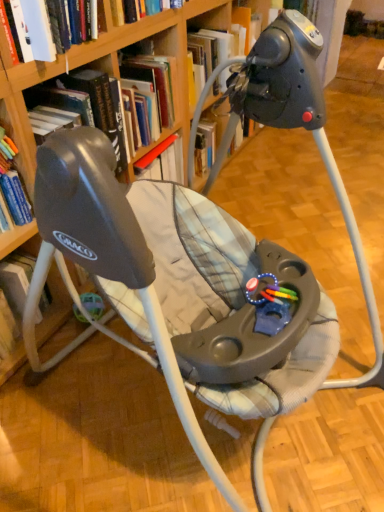
Where is `vacant area situated below wooden bookcase at upper center (from a real-world perspective)`? The height and width of the screenshot is (512, 384). vacant area situated below wooden bookcase at upper center (from a real-world perspective) is located at coordinates (211, 432).